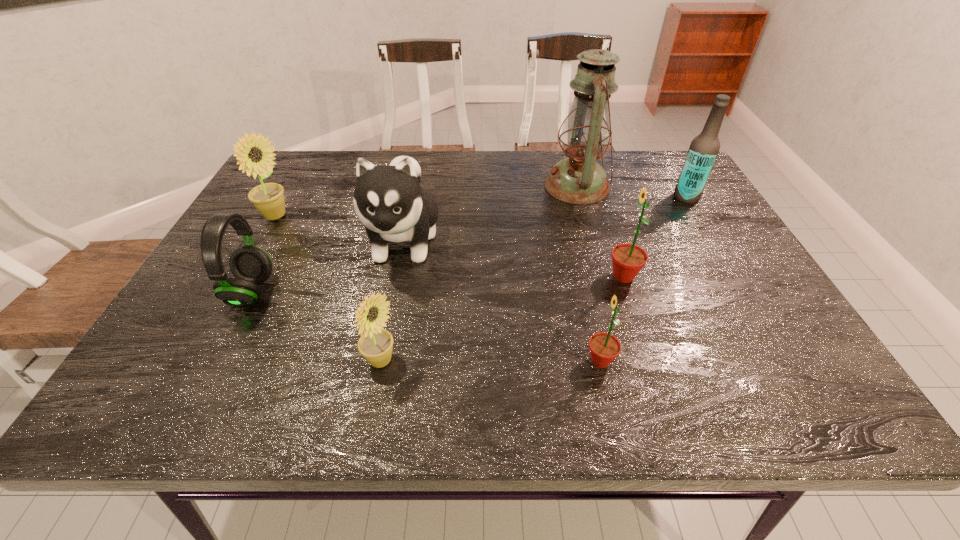
Where is `free region located 0.180m on the face of the rightmost sunflower`? Image resolution: width=960 pixels, height=540 pixels. free region located 0.180m on the face of the rightmost sunflower is located at coordinates (529, 276).

Image resolution: width=960 pixels, height=540 pixels. Find the location of `vacant space situated on the ear cups of the headset`. vacant space situated on the ear cups of the headset is located at coordinates click(x=308, y=292).

Identify the location of vacant space situated on the face of the smaller yellow sunflower. (476, 361).

This screenshot has width=960, height=540. Identify the location of vacant area situated on the face of the left green sunflower. (543, 361).

The height and width of the screenshot is (540, 960). In order to click on vacant region located 0.340m on the face of the left green sunflower in this screenshot , I will do `click(409, 361)`.

Image resolution: width=960 pixels, height=540 pixels. What are the coordinates of `free space located on the face of the left green sunflower` in the screenshot? It's located at (476, 361).

In order to click on oil lamp at the far edge in this screenshot , I will do (x=579, y=179).

The width and height of the screenshot is (960, 540). What are the coordinates of `beer bottle that is at the far edge` in the screenshot? It's located at (704, 148).

This screenshot has height=540, width=960. Find the location of `sunflower situated at the left edge`. sunflower situated at the left edge is located at coordinates coord(268,198).

This screenshot has width=960, height=540. Identify the location of headset located in the left edge section of the desktop. (251, 266).